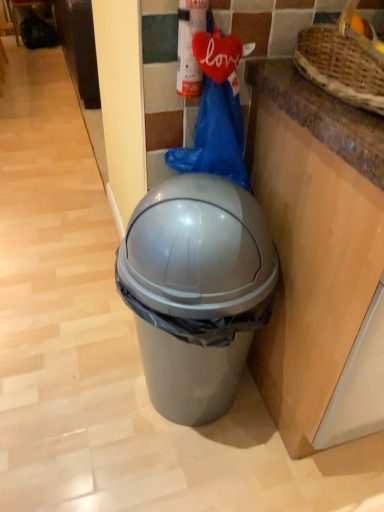
Question: From the image's perspective, does matte gray trash can at center appear lower than brown woven basket at upper right?

Choices:
 (A) no
 (B) yes

Answer: (B)

Question: Does matte gray trash can at center come behind brown woven basket at upper right?

Choices:
 (A) yes
 (B) no

Answer: (A)

Question: Does matte gray trash can at center contain brown woven basket at upper right?

Choices:
 (A) no
 (B) yes

Answer: (A)

Question: Can you confirm if matte gray trash can at center is wider than brown woven basket at upper right?

Choices:
 (A) yes
 (B) no

Answer: (B)

Question: Can you confirm if matte gray trash can at center is positioned to the right of brown woven basket at upper right?

Choices:
 (A) yes
 (B) no

Answer: (B)

Question: Considering the positions of metallic silver extinguisher at upper center and brown woven basket at upper right in the image, is metallic silver extinguisher at upper center bigger or smaller than brown woven basket at upper right?

Choices:
 (A) big
 (B) small

Answer: (B)

Question: Looking at their shapes, would you say metallic silver extinguisher at upper center is wider or thinner than brown woven basket at upper right?

Choices:
 (A) wide
 (B) thin

Answer: (B)

Question: Is metallic silver extinguisher at upper center taller or shorter than brown woven basket at upper right?

Choices:
 (A) tall
 (B) short

Answer: (A)

Question: Considering the positions of point (187, 57) and point (299, 64), is point (187, 57) closer or farther from the camera than point (299, 64)?

Choices:
 (A) closer
 (B) farther

Answer: (A)

Question: Considering the positions of metallic silver extinguisher at upper center and matte gray trash can at center in the image, is metallic silver extinguisher at upper center wider or thinner than matte gray trash can at center?

Choices:
 (A) wide
 (B) thin

Answer: (B)

Question: Considering the positions of metallic silver extinguisher at upper center and matte gray trash can at center in the image, is metallic silver extinguisher at upper center taller or shorter than matte gray trash can at center?

Choices:
 (A) tall
 (B) short

Answer: (B)

Question: Considering the positions of metallic silver extinguisher at upper center and matte gray trash can at center in the image, is metallic silver extinguisher at upper center bigger or smaller than matte gray trash can at center?

Choices:
 (A) small
 (B) big

Answer: (A)

Question: From the image's perspective, is metallic silver extinguisher at upper center located above or below matte gray trash can at center?

Choices:
 (A) below
 (B) above

Answer: (B)

Question: Considering their positions, is matte gray trash can at center located in front of or behind metallic silver extinguisher at upper center?

Choices:
 (A) front
 (B) behind

Answer: (A)

Question: Considering the positions of matte gray trash can at center and metallic silver extinguisher at upper center in the image, is matte gray trash can at center bigger or smaller than metallic silver extinguisher at upper center?

Choices:
 (A) big
 (B) small

Answer: (A)